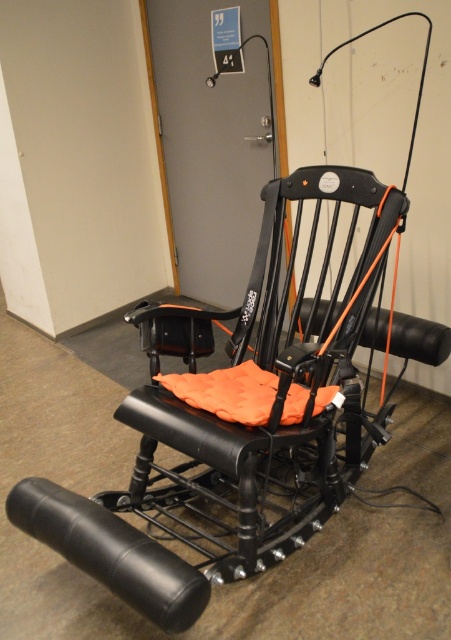
You are standing in front of the exercise equipment and want to reach a point that is exactly 2 meters away from you. Is the point at coordinates point (150, 522) within your reach?

The point at point (150, 522) is 1.98 meters away from the viewer, so yes, it is within reach since it is slightly closer than 2 meters.